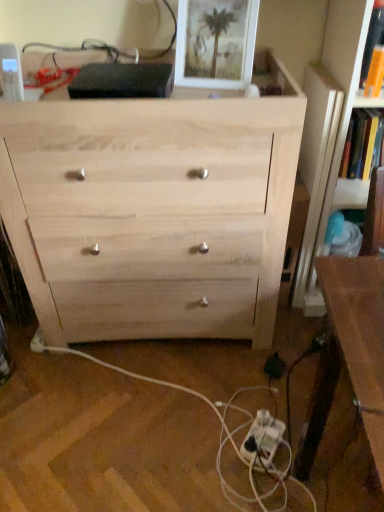
The height and width of the screenshot is (512, 384). Find the location of `vacant area located to the right-hand side of black plastic electric outlet at lower right`. vacant area located to the right-hand side of black plastic electric outlet at lower right is located at coordinates (300, 366).